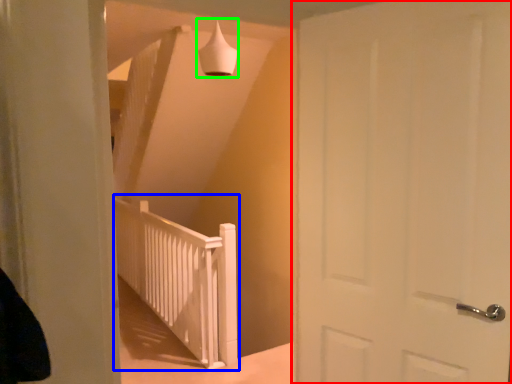
Question: Which is nearer to the door (highlighted by a red box)? rail (highlighted by a blue box) or lamp (highlighted by a green box).

Choices:
 (A) rail
 (B) lamp

Answer: (B)